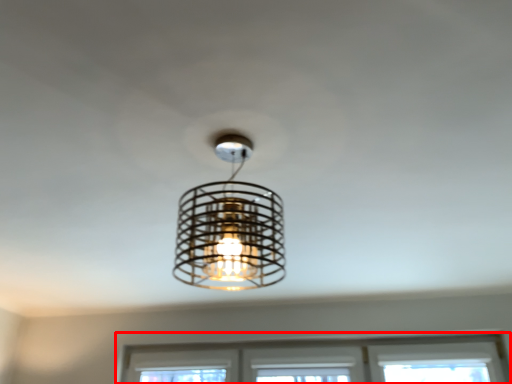
Question: Considering the relative positions of window (annotated by the red box) and lamp in the image provided, where is window (annotated by the red box) located with respect to the staircase?

Choices:
 (A) left
 (B) right

Answer: (B)